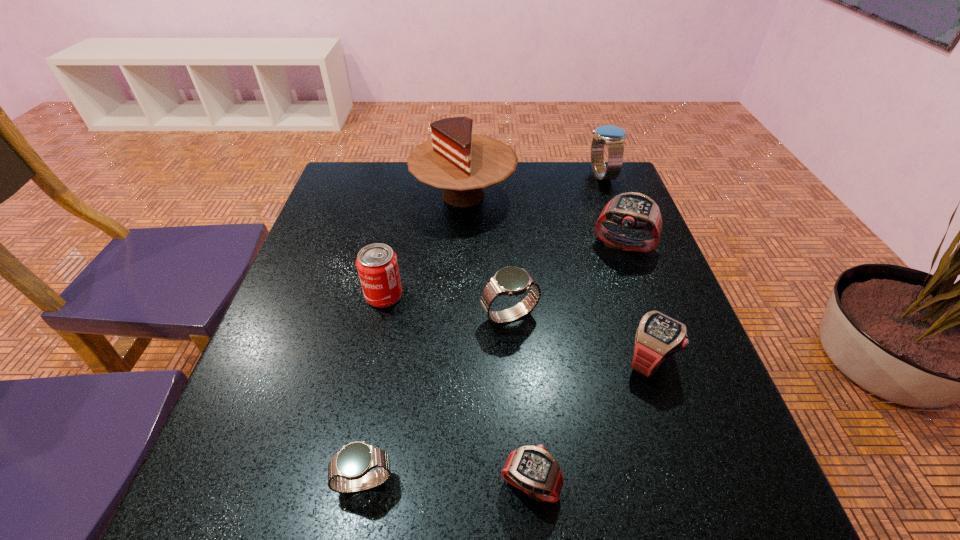
At what (x,y) coordinates should I click in order to perform the action: click on red watch that is the third closest to the smallest blue watch. Please return your answer as a coordinate pair (x, y). Looking at the image, I should click on (x=632, y=210).

The image size is (960, 540). I want to click on free spot that satisfies the following two spatial constraints: 1. on the back side of the rightmost blue watch; 2. on the left side of the smallest red watch, so click(506, 176).

Where is `free spot that satisfies the following two spatial constraints: 1. on the back side of the red can; 2. on the right side of the biggest blue watch`? free spot that satisfies the following two spatial constraints: 1. on the back side of the red can; 2. on the right side of the biggest blue watch is located at coordinates (410, 176).

You are a GUI agent. You are given a task and a screenshot of the screen. Output one action in this format:
    pyautogui.click(x=<x>, y=<y>)
    Task: Click on the blank area in the image that satisfies the following two spatial constraints: 1. on the front side of the can; 2. on the left side of the sixth farthest object
    The width and height of the screenshot is (960, 540).
    Given the screenshot: What is the action you would take?
    pyautogui.click(x=370, y=360)